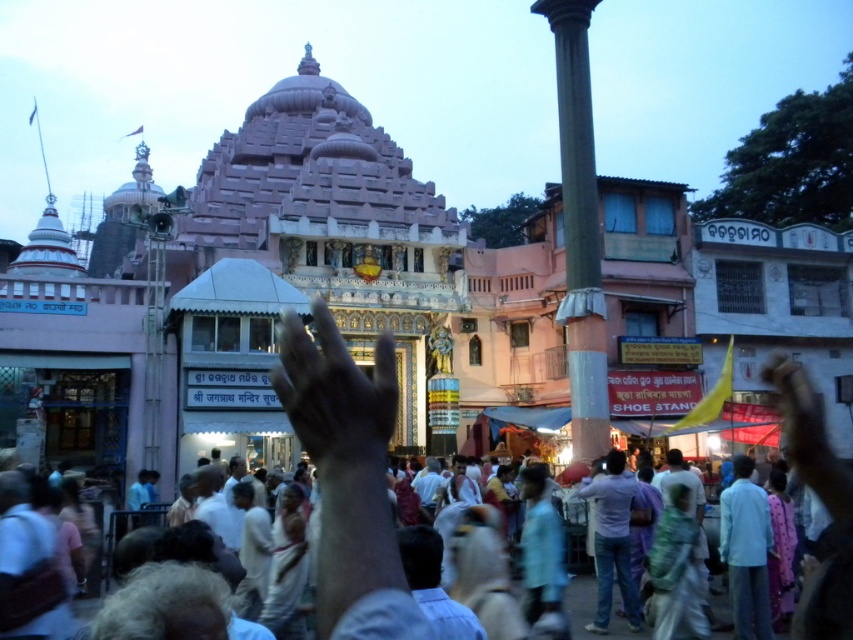
Question: Which object is farther from the camera taking this photo?

Choices:
 (A) smooth gray column at center
 (B) black matte hand at center

Answer: (A)

Question: Among these points, which one is farthest from the camera?

Choices:
 (A) (370, 442)
 (B) (817, 449)
 (C) (351, 634)
 (D) (573, 260)

Answer: (D)

Question: Observing the image, what is the correct spatial positioning of black matte hand at center in reference to matte skin hand at lower right?

Choices:
 (A) right
 (B) left

Answer: (B)

Question: Among these points, which one is nearest to the camera?

Choices:
 (A) (834, 458)
 (B) (798, 620)

Answer: (B)

Question: Can you confirm if smooth gray column at center is thinner than white cotton clothing at center?

Choices:
 (A) yes
 (B) no

Answer: (A)

Question: From the image, what is the correct spatial relationship of white cotton clothing at center in relation to matte skin hand at lower right?

Choices:
 (A) below
 (B) above

Answer: (A)